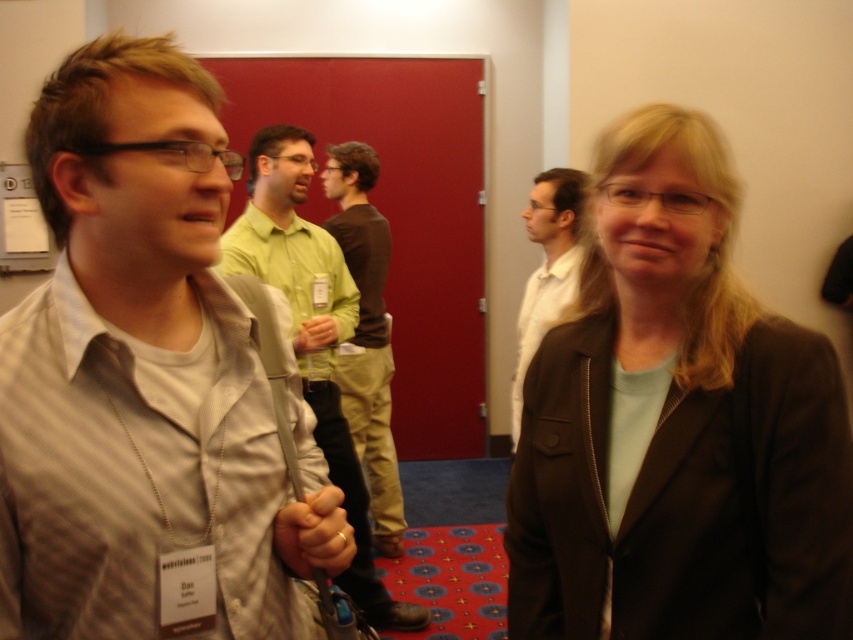
Does light brown shirt at left appear over matte black blazer at center?

Indeed, light brown shirt at left is positioned over matte black blazer at center.

Looking at this image, is the position of light brown shirt at left more distant than that of matte black blazer at center?

No, light brown shirt at left is closer to the viewer.

The height and width of the screenshot is (640, 853). What do you see at coordinates (144, 378) in the screenshot? I see `light brown shirt at left` at bounding box center [144, 378].

Find the location of a particular element. This screenshot has height=640, width=853. light brown shirt at left is located at coordinates (144, 378).

Between light brown shirt at left and brown cotton shirt at center, which one has less height?

With less height is light brown shirt at left.

Between point (103, 554) and point (378, 234), which one is positioned behind?

Positioned behind is point (378, 234).

Where is `light brown shirt at left`? The height and width of the screenshot is (640, 853). light brown shirt at left is located at coordinates (144, 378).

Does light brown shirt at left have a lesser width compared to light green shirt at center?

Indeed, light brown shirt at left has a lesser width compared to light green shirt at center.

Does light brown shirt at left appear over light green shirt at center?

Yes, light brown shirt at left is above light green shirt at center.

Where is `light brown shirt at left`? The width and height of the screenshot is (853, 640). light brown shirt at left is located at coordinates (144, 378).

You are a GUI agent. You are given a task and a screenshot of the screen. Output one action in this format:
    pyautogui.click(x=<x>, y=<y>)
    Task: Click on the light brown shirt at left
    
    Given the screenshot: What is the action you would take?
    pyautogui.click(x=144, y=378)